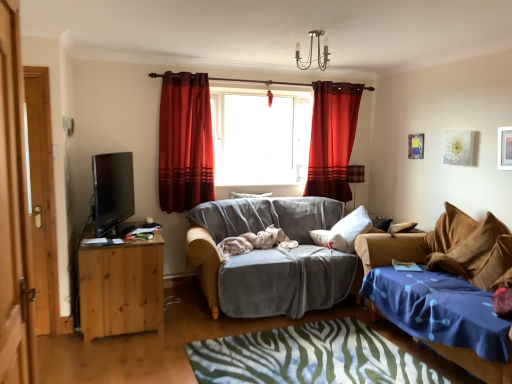
Describe the element at coordinates (14, 213) in the screenshot. Image resolution: width=512 pixels, height=384 pixels. I see `wooden door at left, which is the first door from front to back` at that location.

Identify the location of metallic chandelier at upper center, placed as the second lamp when sorted from back to front. This screenshot has height=384, width=512. (312, 52).

The width and height of the screenshot is (512, 384). What do you see at coordinates (355, 177) in the screenshot? I see `plaid fabric lampshade at right, which is the first lamp in right-to-left order` at bounding box center [355, 177].

Image resolution: width=512 pixels, height=384 pixels. Describe the element at coordinates (112, 190) in the screenshot. I see `matte black tv at left` at that location.

At what (x,y) coordinates should I click in order to perform the action: click on wooden door at left, the first door viewed from the right. Please return your answer as a coordinate pair (x, y). Image resolution: width=512 pixels, height=384 pixels. Looking at the image, I should click on (14, 213).

This screenshot has width=512, height=384. I want to click on television in front of the gray fabric couch at center, placed as the second studio couch when sorted from right to left, so click(x=112, y=190).

From a real-world perspective, is gray fabric couch at center, acting as the 1th studio couch starting from the left, positioned over matte black tv at left based on gravity?

No.

How distant is gray fabric couch at center, acting as the 1th studio couch starting from the left, from matte black tv at left?

They are 4.66 feet apart.

Is point (209, 250) closer to camera compared to point (100, 200)?

Yes, it is in front of point (100, 200).

Which is closer to the camera, (334, 191) or (10, 240)?

The point (10, 240) is more forward.

Is wooden door at left, which is the first door from front to back, located within satin red curtain at center, acting as the 1th curtain starting from the back?

No, wooden door at left, which is the first door from front to back, is located outside of satin red curtain at center, acting as the 1th curtain starting from the back.

From the image's perspective, does satin red curtain at center, acting as the 1th curtain starting from the back, appear lower than wooden door at left, arranged as the second door when viewed from the left?

No.

From the picture: From the image's perspective, between metallic chandelier at upper center, placed as the second lamp when sorted from back to front, and pine wood desk at left, which one is located above?

metallic chandelier at upper center, placed as the second lamp when sorted from back to front, from the image's perspective.

Considering the relative sizes of metallic chandelier at upper center, placed as the second lamp when sorted from back to front, and pine wood desk at left in the image provided, is metallic chandelier at upper center, placed as the second lamp when sorted from back to front, wider than pine wood desk at left?

In fact, metallic chandelier at upper center, placed as the second lamp when sorted from back to front, might be narrower than pine wood desk at left.

Which of these two, metallic chandelier at upper center, the 1th lamp positioned from the left, or pine wood desk at left, stands taller?

With more height is pine wood desk at left.

Do you think metallic chandelier at upper center, the 1th lamp positioned from the left, is within pine wood desk at left, or outside of it?

metallic chandelier at upper center, the 1th lamp positioned from the left, exists outside the volume of pine wood desk at left.

In the scene shown: From a real-world perspective, which object stands above the other?

satin red curtain at center, the 2th curtain viewed from the front, is physically above.

Between satin red curtain at center, which is the second curtain from left to right, and pine wood desk at left, which one appears on the left side from the viewer's perspective?

Positioned to the left is pine wood desk at left.

Between satin red curtain at center, the 1th curtain in the right-to-left sequence, and pine wood desk at left, which one is positioned in front?

pine wood desk at left is more forward.

Between satin red curtain at center, acting as the 1th curtain starting from the back, and pine wood desk at left, which one has larger width?

pine wood desk at left.

Can you confirm if white soft pillow at center, which appears as the 1th pillow when viewed from the front, is taller than transparent glass window at center?

No.

Consider the image. From the image's perspective, who appears lower, white soft pillow at center, marked as the 2th pillow in a back-to-front arrangement, or transparent glass window at center?

white soft pillow at center, marked as the 2th pillow in a back-to-front arrangement.

From a real-world perspective, is white soft pillow at center, placed as the first pillow when sorted from right to left, below transparent glass window at center?

Yes.

Find the location of `lamp above the velvet deep red curtain at center, the 2th curtain positioned from the right (from the image's perspective)`. lamp above the velvet deep red curtain at center, the 2th curtain positioned from the right (from the image's perspective) is located at coordinates tap(312, 52).

From the image's perspective, is metallic chandelier at upper center, which ranks as the 1th lamp in front-to-back order, located beneath velvet deep red curtain at center, acting as the first curtain starting from the front?

No.

Would you say metallic chandelier at upper center, placed as the second lamp when sorted from back to front, is outside velvet deep red curtain at center, positioned as the second curtain in back-to-front order?

That's correct, metallic chandelier at upper center, placed as the second lamp when sorted from back to front, is outside of velvet deep red curtain at center, positioned as the second curtain in back-to-front order.

The width and height of the screenshot is (512, 384). In order to click on the 1st pillow behind the wooden door at left, which is the first door from front to back in this screenshot , I will do `click(344, 231)`.

Considering the positions of point (34, 340) and point (349, 249), is point (34, 340) closer or farther from the camera than point (349, 249)?

Point (34, 340).

Is wooden door at left, which is the first door from front to back, next to white soft pillow at center, the second pillow when ordered from top to bottom, and touching it?

No.

From the image's perspective, would you say wooden door at left, arranged as the second door when viewed from the left, is positioned over white soft pillow at center, marked as the 1th pillow in a bottom-to-top arrangement?

Correct, wooden door at left, arranged as the second door when viewed from the left, appears higher than white soft pillow at center, marked as the 1th pillow in a bottom-to-top arrangement, in the image.

The width and height of the screenshot is (512, 384). Find the location of `television that appears on the left of gray fabric couch at center, placed as the second studio couch when sorted from right to left`. television that appears on the left of gray fabric couch at center, placed as the second studio couch when sorted from right to left is located at coordinates (112, 190).

From the image's perspective, which door is the 1st one below the satin red curtain at center, the 1th curtain in the right-to-left sequence? Please provide its 2D coordinates.

[(14, 213)]

From the image, which object appears to be farther from blue fabric bedcover at lower center, matte black tv at left or gray fabric couch at center, placed as the second studio couch when sorted from right to left?

matte black tv at left lies further to blue fabric bedcover at lower center than the other object.

From the image, which object appears to be nearer to metallic chandelier at upper center, which ranks as the 1th lamp in front-to-back order, pine wood desk at left or matte black tv at left?

Among the two, matte black tv at left is located nearer to metallic chandelier at upper center, which ranks as the 1th lamp in front-to-back order.

Based on their spatial positions, is matte black tv at left or metallic chandelier at upper center, which is the 2th lamp from right to left, further from pine wood desk at left?

The object further to pine wood desk at left is metallic chandelier at upper center, which is the 2th lamp from right to left.

Considering their positions, is gray fabric couch at center, acting as the 1th studio couch starting from the left, positioned closer to blue fabric bedcover at lower center than metallic gold picture frame at upper right, the 2th picture frame positioned from the front?

Based on the image, gray fabric couch at center, acting as the 1th studio couch starting from the left, appears to be nearer to blue fabric bedcover at lower center.

Which object lies further to the anchor point pine wood desk at left, velvet deep red curtain at center, marked as the first curtain in a left-to-right arrangement, or transparent glass window at center?

transparent glass window at center is further to pine wood desk at left.

From the image, which object appears to be farther from white soft pillow at center, acting as the 2th pillow starting from the left, satin red curtain at center, the 1th curtain in the right-to-left sequence, or matte black tv at left?

matte black tv at left is further to white soft pillow at center, acting as the 2th pillow starting from the left.

Based on their spatial positions, is matte black tv at left or velvet blue studio couch at lower right, the first studio couch positioned from the right, further from pine wood desk at left?

Based on the image, velvet blue studio couch at lower right, the first studio couch positioned from the right, appears to be further to pine wood desk at left.

Based on the photo, estimate the real-world distances between objects in this image. Which object is further from wooden door at left, which is the 2th door in back-to-front order, blue fabric bedcover at lower center or velvet deep red curtain at center, positioned as the second curtain in back-to-front order?

velvet deep red curtain at center, positioned as the second curtain in back-to-front order, is further to wooden door at left, which is the 2th door in back-to-front order.

Find the location of a particular element. window situated between wooden door at left, the 2th door when ordered from front to back, and white matte picture frame at upper right, placed as the second picture frame when sorted from back to front, from left to right is located at coordinates (260, 137).

The image size is (512, 384). I want to click on bedcover between matte black tv at left and white matte picture frame at upper right, the 1th picture frame in the right-to-left sequence, in the horizontal direction, so click(308, 357).

The width and height of the screenshot is (512, 384). Identify the location of desk between wooden door at left, the 2th door when ordered from front to back, and metallic gold picture frame at upper right, which is the 1th picture frame in back-to-front order, from left to right. (121, 288).

At what (x,y) coordinates should I click in order to perform the action: click on lamp positioned between wooden door at left, which is the 2th door in back-to-front order, and transparent glass window at center from near to far. Please return your answer as a coordinate pair (x, y). The width and height of the screenshot is (512, 384). Looking at the image, I should click on (312, 52).